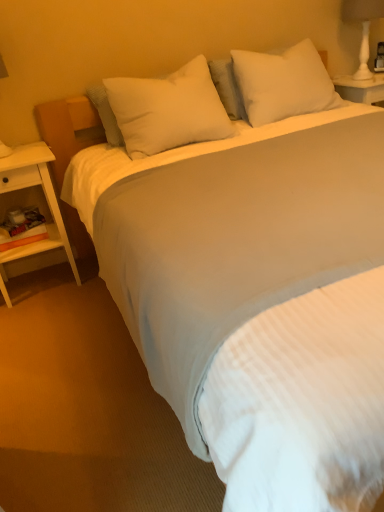
Locate an element on the screen. This screenshot has height=512, width=384. free spot below white wood nightstand at left (from a real-world perspective) is located at coordinates (41, 283).